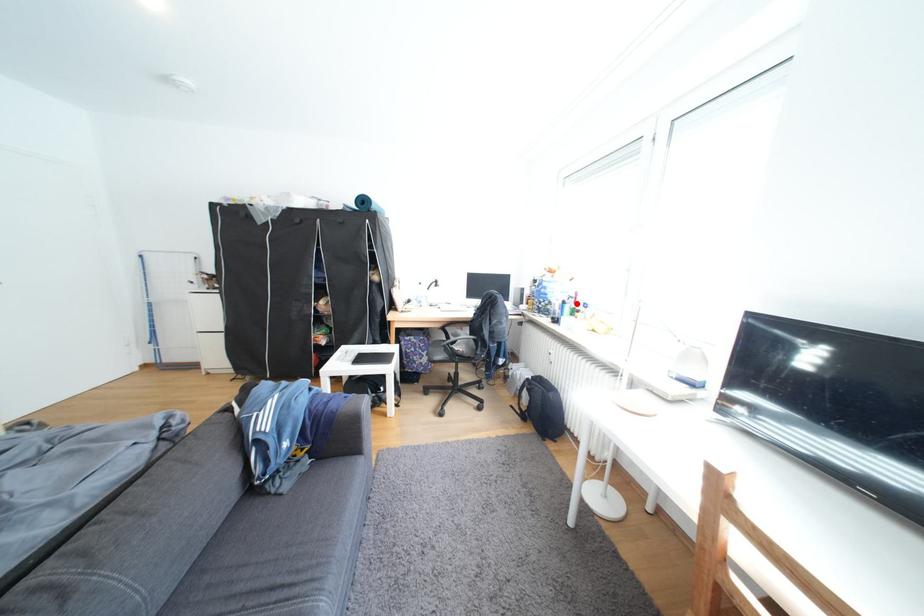
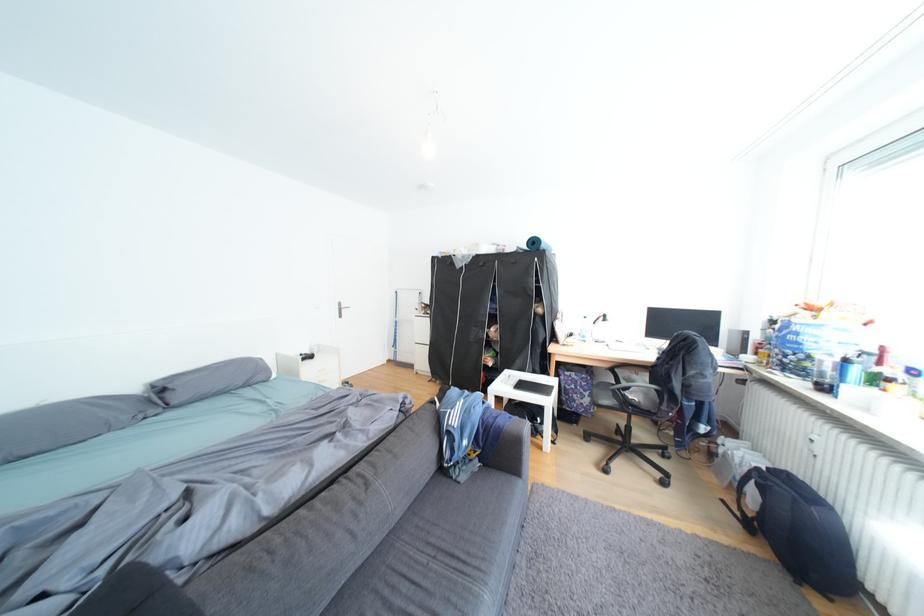
In the second image, find the point that corresponds to the highlighted location in the first image.

(859, 362)